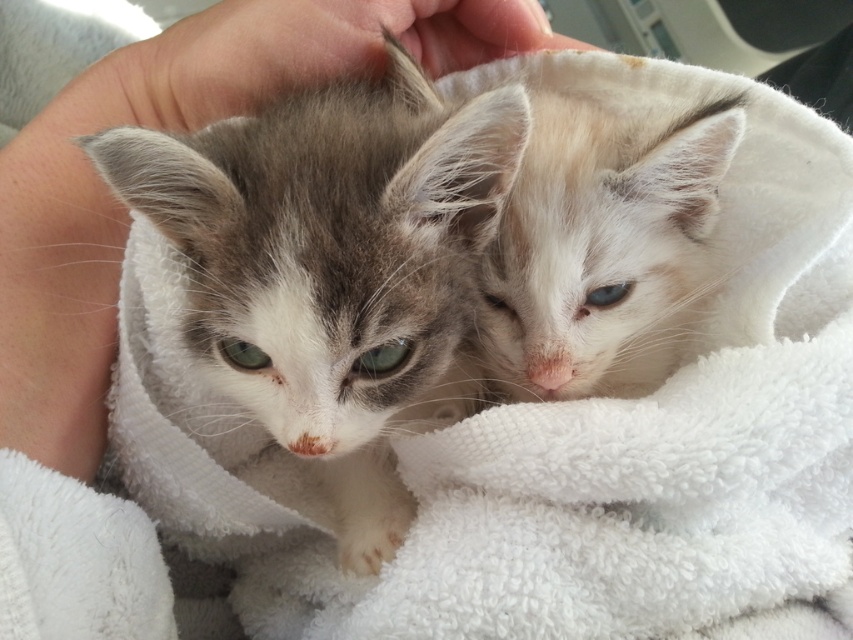
You are a photographer trying to capture a closeup of the gray fluffy kitten at center. The camera you are using has a focus point at coordinate point (334, 266). Will the gray fluffy kitten at center be in focus?

Yes, the gray fluffy kitten at center is located exactly at point (334, 266), so the focus point will capture it clearly.

You are a photographer trying to capture a closeup shot of the kittens in the image. The focus point of your camera is set at point (350,253). If the camera is 29.51 inches away from this point, will the kittens be in focus?

The point (350,253) is 29.51 inches away from the camera, so the kittens will be in focus if the focus point is set correctly at that distance.

In the scene shown: In the image, you notice the gray fluffy kitten at center. Can you determine its exact 2D coordinates in the scene?

The gray fluffy kitten at center is located at the 2D coordinates of point (334, 266).